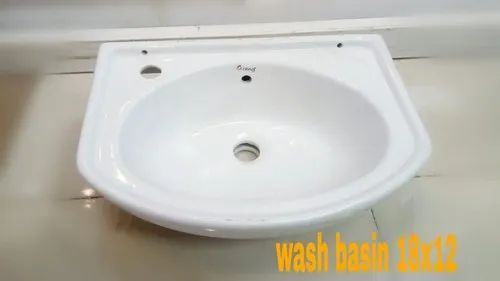
At what (x,y) coordinates should I click in order to perform the action: click on white wall. Please return your answer as a coordinate pair (x, y). The width and height of the screenshot is (500, 281). Looking at the image, I should click on (199, 14).